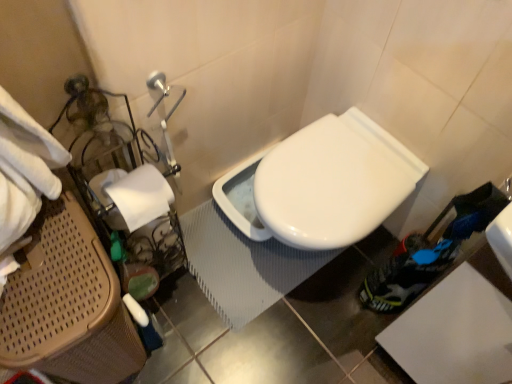
Question: From a real-world perspective, is white glossy toilet at center on top of white matte toilet paper at left?

Choices:
 (A) yes
 (B) no

Answer: (B)

Question: Is white glossy toilet at center next to white matte toilet paper at left and touching it?

Choices:
 (A) yes
 (B) no

Answer: (B)

Question: Is white glossy toilet at center facing towards white matte toilet paper at left?

Choices:
 (A) no
 (B) yes

Answer: (A)

Question: Considering the relative sizes of white glossy toilet at center and white matte toilet paper at left in the image provided, is white glossy toilet at center taller than white matte toilet paper at left?

Choices:
 (A) yes
 (B) no

Answer: (A)

Question: From the image's perspective, is white glossy toilet at center located above white matte toilet paper at left?

Choices:
 (A) no
 (B) yes

Answer: (A)

Question: Is white glossy toilet at center looking in the opposite direction of white matte toilet paper at left?

Choices:
 (A) yes
 (B) no

Answer: (B)

Question: Considering the relative positions of white matte toilet paper at left and white glossy toilet at center in the image provided, is white matte toilet paper at left to the right of white glossy toilet at center from the viewer's perspective?

Choices:
 (A) no
 (B) yes

Answer: (A)

Question: Can you confirm if white matte toilet paper at left is taller than white glossy toilet at center?

Choices:
 (A) yes
 (B) no

Answer: (B)

Question: Does white matte toilet paper at left have a greater width compared to white glossy toilet at center?

Choices:
 (A) yes
 (B) no

Answer: (B)

Question: From the image's perspective, is white matte toilet paper at left under white glossy toilet at center?

Choices:
 (A) yes
 (B) no

Answer: (B)

Question: Is white matte toilet paper at left bigger than white glossy toilet at center?

Choices:
 (A) yes
 (B) no

Answer: (B)

Question: Is white glossy toilet at center completely or partially inside white matte toilet paper at left?

Choices:
 (A) yes
 (B) no

Answer: (B)

Question: Considering the relative positions of white glossy toilet at center and brown woven laundry basket at left in the image provided, is white glossy toilet at center behind brown woven laundry basket at left?

Choices:
 (A) no
 (B) yes

Answer: (B)